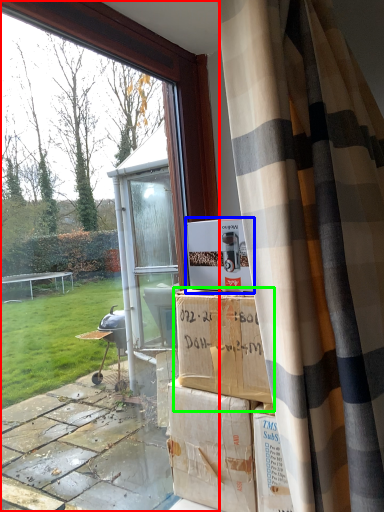
Question: Which is nearer to the window (highlighted by a red box)? cardboard box (highlighted by a blue box) or cardboard box (highlighted by a green box).

Choices:
 (A) cardboard box
 (B) cardboard box

Answer: (A)